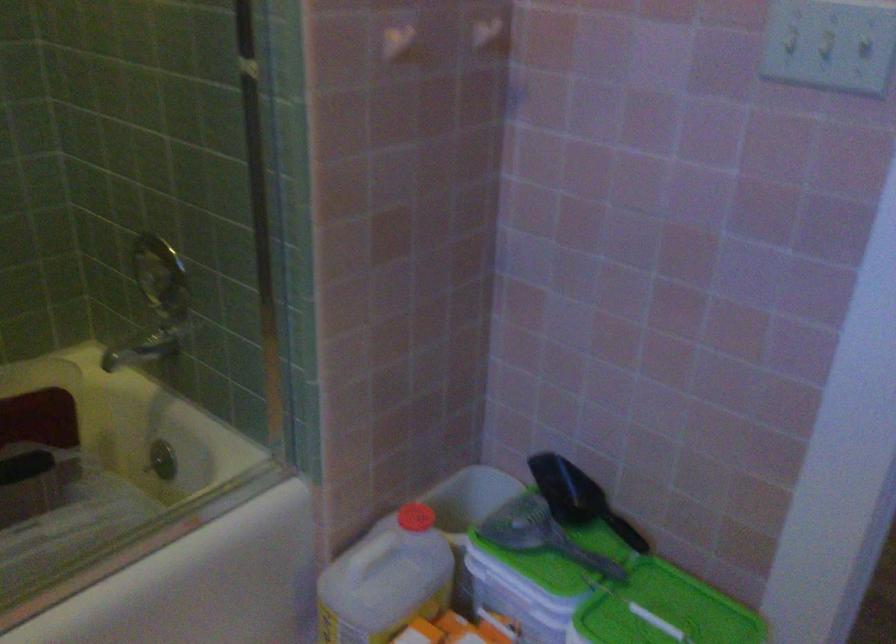
Find the location of a particular element. This screenshot has height=644, width=896. white plastic jug is located at coordinates (385, 581).